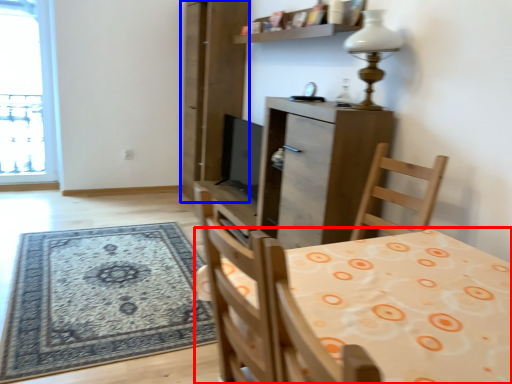
Question: Which of the following is the closest to the observer, table (highlighted by a red box) or screen door (highlighted by a blue box)?

Choices:
 (A) table
 (B) screen door

Answer: (A)